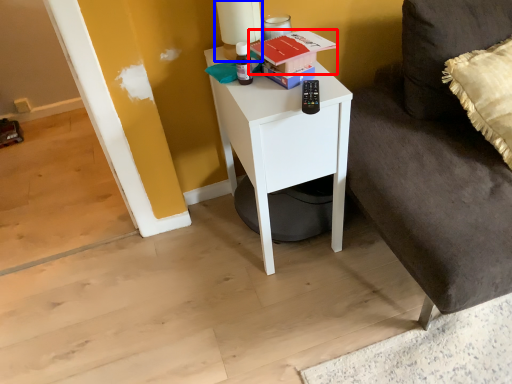
Question: Which object is further to the camera taking this photo, book (highlighted by a red box) or table lamp (highlighted by a blue box)?

Choices:
 (A) book
 (B) table lamp

Answer: (B)